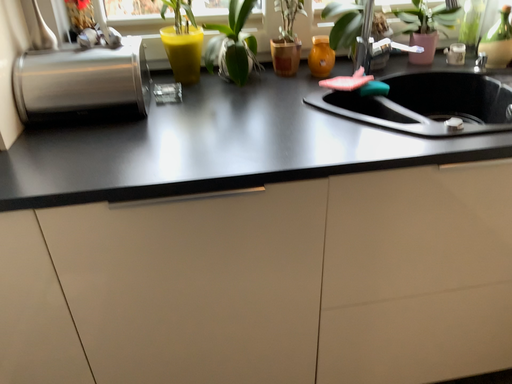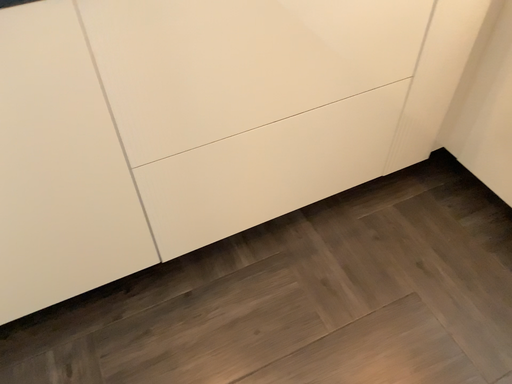
Question: Which way did the camera rotate in the video?

Choices:
 (A) rotated right
 (B) rotated left

Answer: (A)